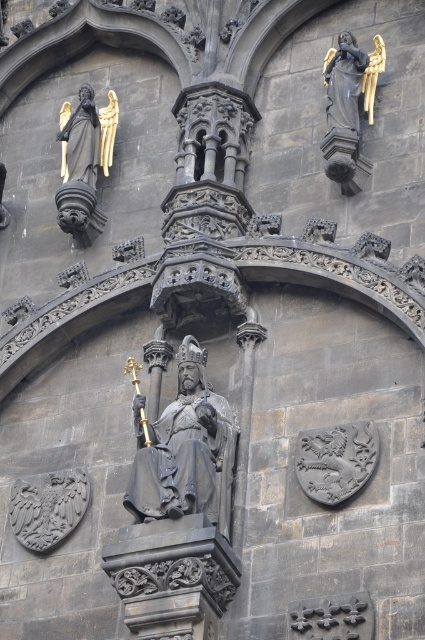
You are an architect examining the Gothic facade. You notice a point marked at coordinates [186,451]. Based on the scene description, what does this point most likely represent?

The point at [186,451] marks the location of the polished bronze statue at center, which is the central statue of a crowned figure holding a scepter and a book.

You are an art conservator examining the Gothic facade. You need to clean the polished bronze statue at center and the gold leaf statue at upper left. Which statue should you start with if you want to work from the closest to furthest from your current position?

You should start with the polished bronze statue at center because it is in front of the gold leaf statue at upper left, making it closer to your current position.